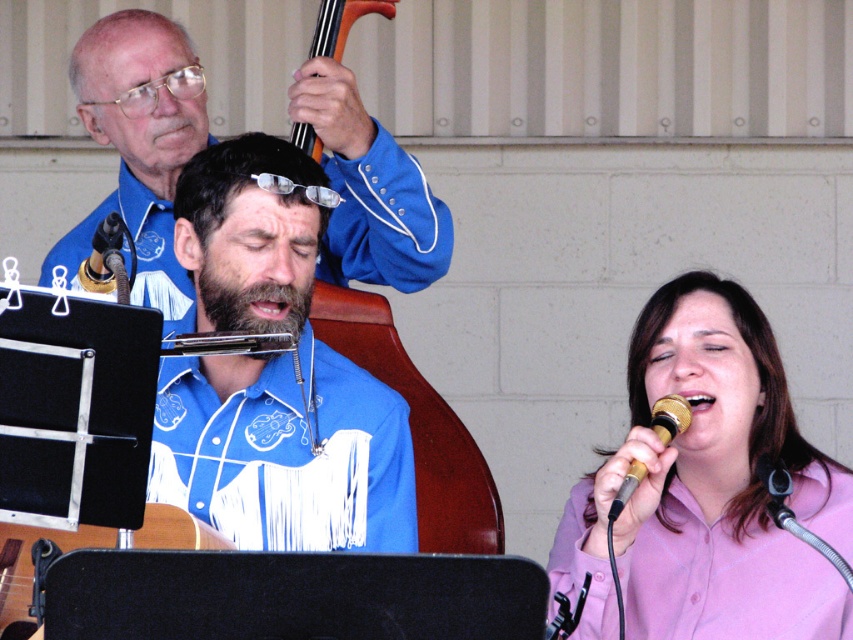
Consider the image. Can you confirm if pink satin shirt at lower right is positioned to the left of gold metallic microphone at lower right?

In fact, pink satin shirt at lower right is to the right of gold metallic microphone at lower right.

At what (x,y) coordinates should I click in order to perform the action: click on pink satin shirt at lower right. Please return your answer as a coordinate pair (x, y). Looking at the image, I should click on (726, 579).

Who is more forward, (840, 476) or (657, 419)?

Point (657, 419) is in front.

Find the location of `pink satin shirt at lower right`. pink satin shirt at lower right is located at coordinates (726, 579).

Can you confirm if pink satin shirt at right is positioned to the left of orange wood violin at upper center?

In fact, pink satin shirt at right is to the right of orange wood violin at upper center.

Where is `pink satin shirt at right`? The width and height of the screenshot is (853, 640). pink satin shirt at right is located at coordinates (708, 490).

Who is more forward, (651, 321) or (370, 8)?

Point (651, 321) is in front.

Identify the location of pink satin shirt at right. The height and width of the screenshot is (640, 853). (708, 490).

Based on the photo, is blue denim shirt at upper left above orange wood violin at upper center?

Actually, blue denim shirt at upper left is below orange wood violin at upper center.

Is blue denim shirt at upper left to the right of orange wood violin at upper center from the viewer's perspective?

Incorrect, blue denim shirt at upper left is not on the right side of orange wood violin at upper center.

The width and height of the screenshot is (853, 640). I want to click on blue denim shirt at upper left, so (x=138, y=141).

I want to click on blue denim shirt at upper left, so click(138, 141).